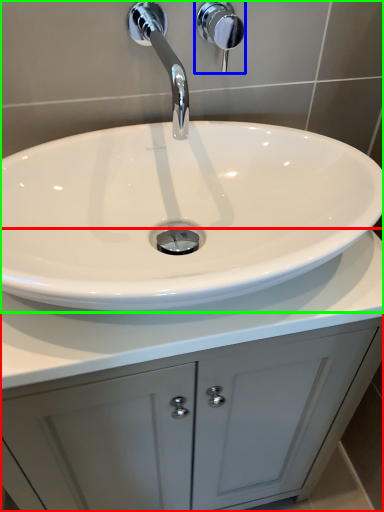
Question: Based on their relative distances, which object is farther from bathroom cabinet (highlighted by a red box)? Choose from shower (highlighted by a blue box) and sink (highlighted by a green box).

Choices:
 (A) shower
 (B) sink

Answer: (A)